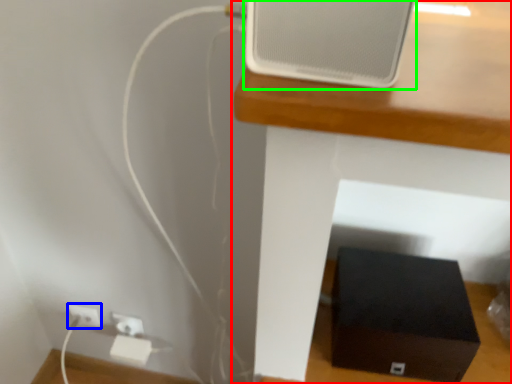
Question: Which object is positioned closest to furniture (highlighted by a red box)? Select from electric outlet (highlighted by a blue box) and ipod (highlighted by a green box).

Choices:
 (A) electric outlet
 (B) ipod

Answer: (B)